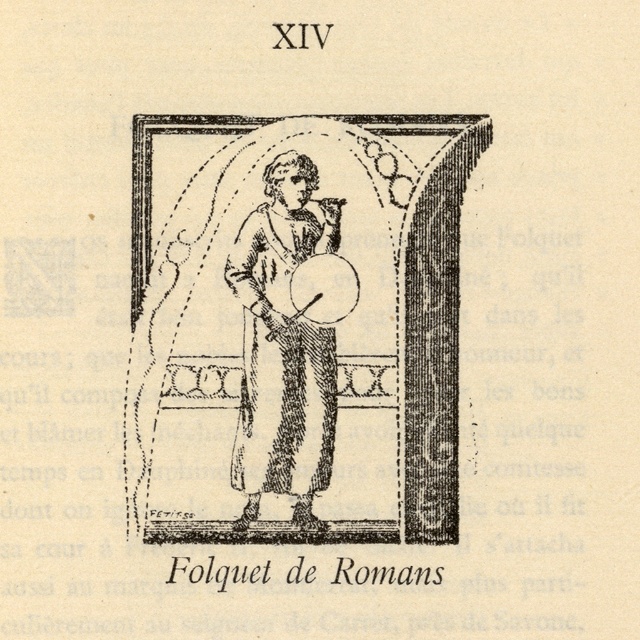
You are an art historian examining this black and white illustration. You notice two figures labeled as the black ink drawing of man at center and the black ink drawing of person at center. Which figure is depicted higher up in the image?

The black ink drawing of man at center is positioned over the black ink drawing of person at center, meaning it is higher up in the image.

You are an art historian examining this black and white illustration. You notice the black ink drawing of man at center. Based on the coordinates provided in the scene description, can you determine if the man is positioned exactly at the center of the image?

The black ink drawing of man at center is located at point (298, 330), which is very close to the exact center coordinates of (320, 320). Therefore, the man is positioned almost exactly at the center of the image.

You are an art conservator working on a large black and white illustration. You need to place a protective barrier between the black ink drawing of man at center and the black ink drawing of person at center. The barrier must be exactly 5 feet wide. Will the barrier fit perfectly between them?

The black ink drawing of man at center and black ink drawing of person at center are 5.05 feet apart from each other. Since the barrier is exactly 5 feet wide, there will be a small gap of 0.05 feet remaining between the barrier and the edges of both drawings.